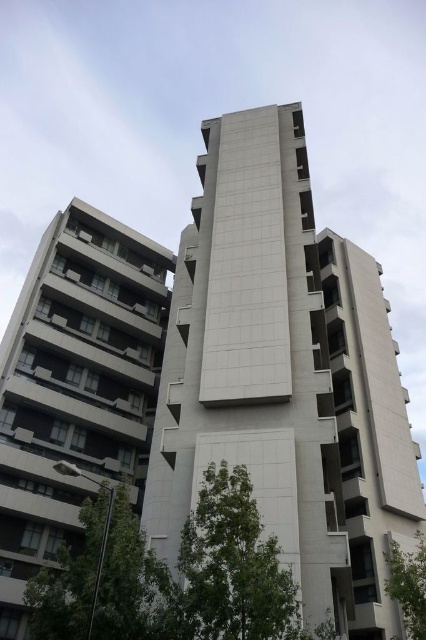
Does point (138, 406) lie behind point (255, 547)?

Yes, it is behind point (255, 547).

Based on the photo, is white smooth building at left thinner than green leafy tree at lower center?

No, white smooth building at left is not thinner than green leafy tree at lower center.

Is point (75, 339) positioned in front of point (239, 502)?

No, (75, 339) is further to viewer.

I want to click on white smooth building at left, so click(x=75, y=385).

Between white concrete building at center and white smooth building at left, which one appears on the left side from the viewer's perspective?

From the viewer's perspective, white smooth building at left appears more on the left side.

Which is behind, point (273, 243) or point (5, 444)?

Positioned behind is point (5, 444).

Locate an element on the screen. white concrete building at center is located at coordinates (284, 376).

Can you confirm if white smooth building at left is wider than green leafy tree at lower right?

Correct, the width of white smooth building at left exceeds that of green leafy tree at lower right.

Who is more distant from viewer, (x=5, y=499) or (x=409, y=556)?

The point (x=5, y=499) is more distant.

Image resolution: width=426 pixels, height=640 pixels. Identify the location of white smooth building at left. (75, 385).